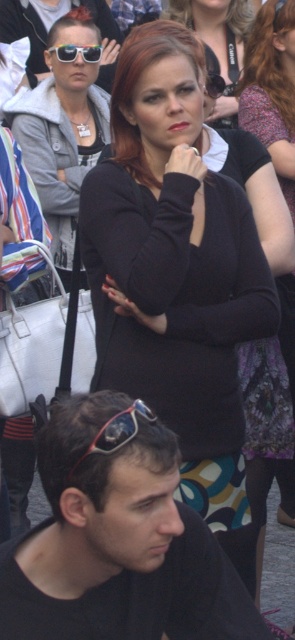
From the picture: You are a fashion designer observing the image and want to know which item has a narrower width between the black jersey at center and the matte black top at center. Can you help determine this?

The black jersey at center has a lesser width compared to the matte black top at center, so the black jersey at center is narrower in width.

You are a photographer at the event and need to adjust your camera focus. The black matte dress at center and the red plastic sunglasses at lower left are both in your frame. Which object should you focus on first if you want to prioritize the taller one?

The black matte dress at center is taller than the red plastic sunglasses at lower left, so you should focus on the black matte dress at center first.

You are organizing a charity event and need to decide which item to place on a small display stand that can only accommodate items up to 15 cm in size. You have the black matte sunglasses at lower left and the black jersey at center. Based on their sizes, which item should you choose for the display stand?

The black jersey at center should be chosen for the display stand since the black matte sunglasses at lower left is larger in size than the black jersey at center, making the jersey more likely to fit within the 15 cm size limit.